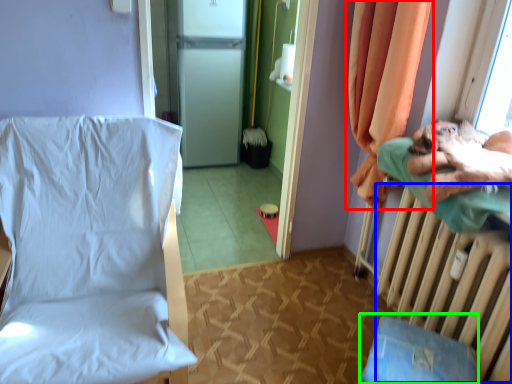
Question: Which object is the closest to the curtain (highlighted by a red box)? Choose among these: radiator (highlighted by a blue box) or changing table (highlighted by a green box).

Choices:
 (A) radiator
 (B) changing table

Answer: (A)